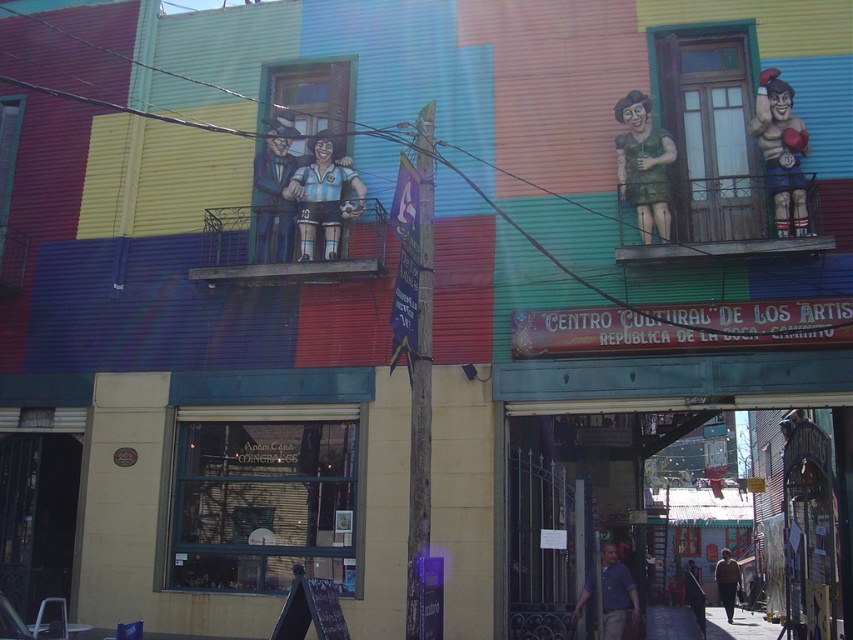
Question: Which point is closer to the camera?

Choices:
 (A) wooden at center
 (B) matte plastic boxer at upper right
 (C) matte black suit at upper center
 (D) green matte statue at upper right

Answer: (B)

Question: Which of the following is the closest to the observer?

Choices:
 (A) matte black suit at upper center
 (B) matte plastic boxer at upper right
 (C) wooden at center
 (D) blue shirt at center

Answer: (D)

Question: Which object appears farthest from the camera in this image?

Choices:
 (A) wooden at center
 (B) matte black soccer player at center
 (C) dark blue suit at lower right

Answer: (C)

Question: Is matte black soccer player at center behind dark blue suit at lower right?

Choices:
 (A) yes
 (B) no

Answer: (B)

Question: Is matte black soccer player at center above dark brown leather jacket at lower right?

Choices:
 (A) no
 (B) yes

Answer: (B)

Question: Observing the image, what is the correct spatial positioning of wooden at center in reference to matte plastic boxer at upper right?

Choices:
 (A) right
 (B) left

Answer: (B)